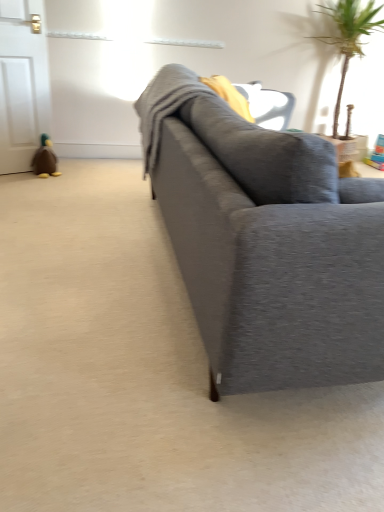
The image size is (384, 512). In order to click on free space to the right of brown plush duck at left in this screenshot , I will do `click(70, 177)`.